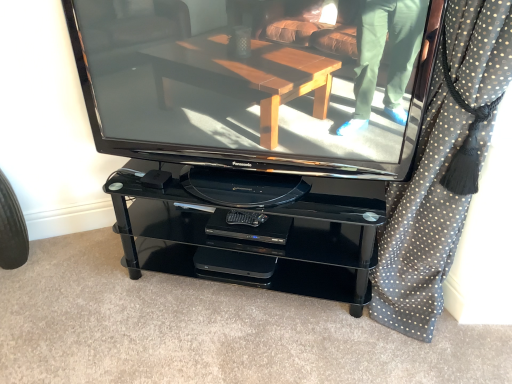
This screenshot has width=512, height=384. In order to click on free spot in front of black rubber tire at lower left in this screenshot , I will do `click(15, 294)`.